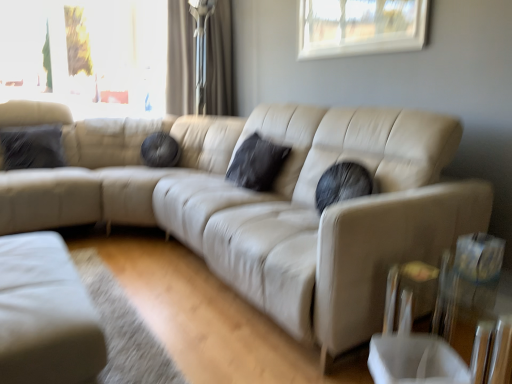
Question: Which direction should I rotate to look at black matte pillow at center, the 1th pillow positioned from the right, — up or down?

Choices:
 (A) down
 (B) up

Answer: (B)

Question: Considering the relative sizes of transparent glass window at upper center and black matte pillow at center, the 2th pillow positioned from the left, in the image provided, is transparent glass window at upper center shorter than black matte pillow at center, the 2th pillow positioned from the left,?

Choices:
 (A) yes
 (B) no

Answer: (A)

Question: Can you confirm if transparent glass window at upper center is thinner than black matte pillow at center, the 1th pillow positioned from the right?

Choices:
 (A) yes
 (B) no

Answer: (A)

Question: Is transparent glass window at upper center positioned beyond the bounds of black matte pillow at center, the 2th pillow positioned from the left?

Choices:
 (A) yes
 (B) no

Answer: (A)

Question: From a real-world perspective, is transparent glass window at upper center physically below black matte pillow at center, the 1th pillow positioned from the right?

Choices:
 (A) no
 (B) yes

Answer: (A)

Question: Is transparent glass window at upper center further to camera compared to black matte pillow at center, the 1th pillow positioned from the right?

Choices:
 (A) yes
 (B) no

Answer: (B)

Question: Can black matte pillow at center, the 1th pillow positioned from the right, be found inside transparent glass window at upper center?

Choices:
 (A) no
 (B) yes

Answer: (A)

Question: From the image's perspective, is beige leather couch at center above transparent glass table at lower right?

Choices:
 (A) yes
 (B) no

Answer: (A)

Question: Does beige leather couch at center have a greater width compared to transparent glass table at lower right?

Choices:
 (A) yes
 (B) no

Answer: (A)

Question: Is beige leather couch at center taller than transparent glass table at lower right?

Choices:
 (A) yes
 (B) no

Answer: (A)

Question: Is beige leather couch at center oriented away from transparent glass table at lower right?

Choices:
 (A) yes
 (B) no

Answer: (B)

Question: Can you confirm if beige leather couch at center is smaller than transparent glass table at lower right?

Choices:
 (A) no
 (B) yes

Answer: (A)

Question: Is the depth of beige leather couch at center greater than that of transparent glass table at lower right?

Choices:
 (A) yes
 (B) no

Answer: (A)

Question: Is beige leather couch at center aimed at velvet dark gray pillow at left, which is the 2th pillow from right to left?

Choices:
 (A) yes
 (B) no

Answer: (B)